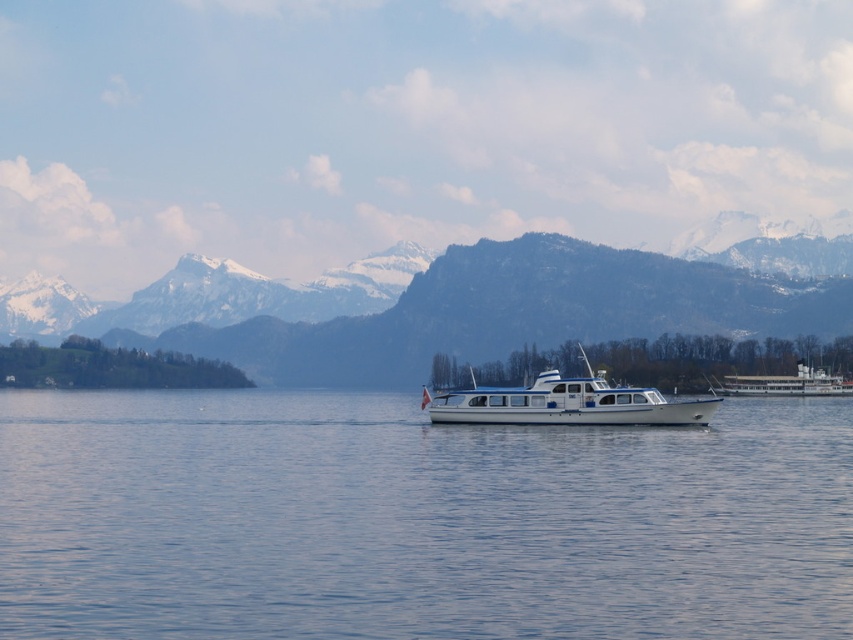
Who is positioned more to the right, blue water at center or white glossy boat at center?

From the viewer's perspective, white glossy boat at center appears more on the right side.

Between blue water at center and white glossy boat at center, which one has more height?

blue water at center

Does point (329, 609) lie behind point (614, 404)?

No.

Find the location of a particular element. blue water at center is located at coordinates (415, 520).

Can you confirm if blue water at center is thinner than snowy rock mountain range at left?

Yes.

Can you confirm if blue water at center is bigger than snowy rock mountain range at left?

Incorrect, blue water at center is not larger than snowy rock mountain range at left.

The height and width of the screenshot is (640, 853). Describe the element at coordinates (415, 520) in the screenshot. I see `blue water at center` at that location.

I want to click on blue water at center, so click(415, 520).

Does snowy rock mountain range at left appear over white glossy boat at center?

Correct, snowy rock mountain range at left is located above white glossy boat at center.

Who is more forward, (608, 317) or (640, 419)?

Point (640, 419) is more forward.

The width and height of the screenshot is (853, 640). I want to click on snowy rock mountain range at left, so click(x=471, y=304).